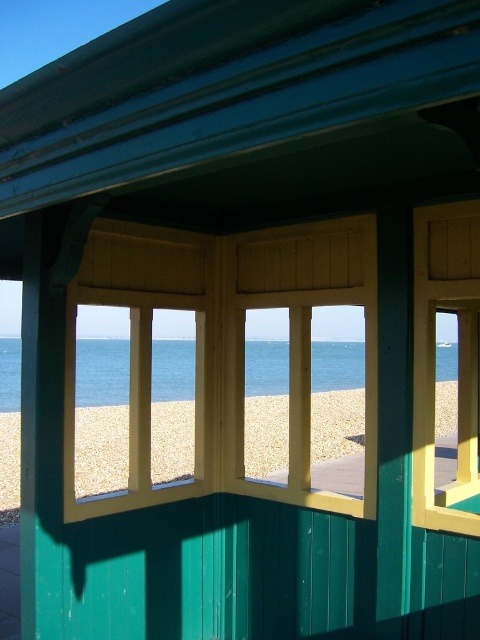
Question: Does smooth sand at lower center have a lesser width compared to blue water at center?

Choices:
 (A) no
 (B) yes

Answer: (B)

Question: Can you confirm if smooth sand at lower center is positioned below blue water at center?

Choices:
 (A) no
 (B) yes

Answer: (B)

Question: Which point is farther to the camera?

Choices:
 (A) (7, 392)
 (B) (259, 442)

Answer: (A)

Question: In this image, where is smooth sand at lower center located relative to blue water at center?

Choices:
 (A) above
 (B) below

Answer: (B)

Question: Among these points, which one is nearest to the camera?

Choices:
 (A) (111, 364)
 (B) (356, 394)

Answer: (B)

Question: Among these points, which one is nearest to the camera?

Choices:
 (A) (287, 404)
 (B) (351, 358)

Answer: (A)